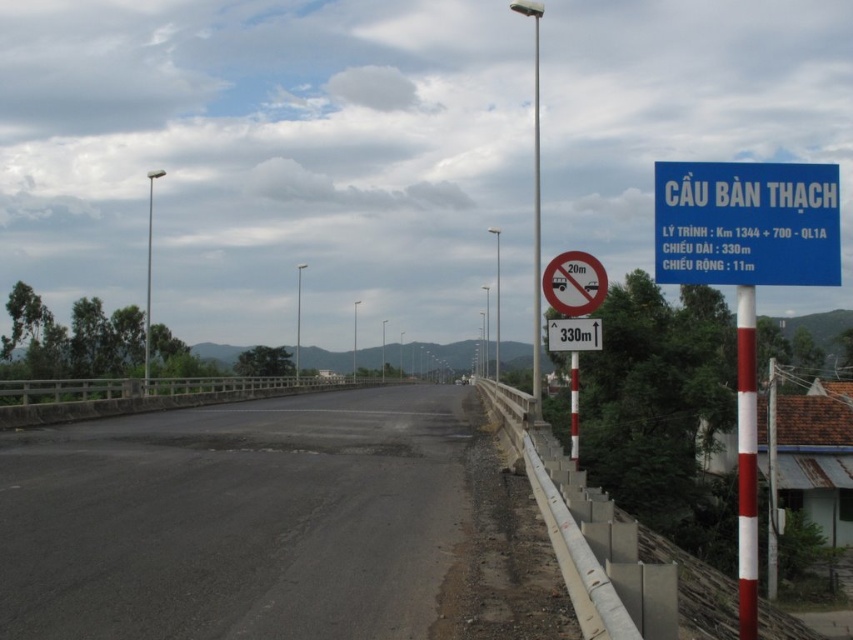
Between black asphalt road at center and red/white striped pole at right, which one has more height?

red/white striped pole at right

Between point (141, 477) and point (751, 621), which one is positioned in front?

Point (751, 621) is in front.

Between point (213, 509) and point (747, 524), which one is positioned in front?

Positioned in front is point (747, 524).

Image resolution: width=853 pixels, height=640 pixels. I want to click on black asphalt road at center, so click(x=235, y=518).

Can you confirm if white plastic pole at right is smaller than white striped pole at right?

Incorrect, white plastic pole at right is not smaller in size than white striped pole at right.

Who is more forward, (538, 84) or (576, 449)?

Point (576, 449) is more forward.

At what (x,y) coordinates should I click in order to perform the action: click on white plastic pole at right. Please return your answer as a coordinate pair (x, y). Looking at the image, I should click on (537, 212).

Does black asphalt road at center have a lesser width compared to white striped pole at right?

Incorrect, black asphalt road at center's width is not less than white striped pole at right's.

Is black asphalt road at center above white striped pole at right?

Correct, black asphalt road at center is located above white striped pole at right.

Does point (358, 417) come behind point (569, 456)?

Yes, point (358, 417) is farther from viewer.

At what (x,y) coordinates should I click in order to perform the action: click on black asphalt road at center. Please return your answer as a coordinate pair (x, y). Looking at the image, I should click on (235, 518).